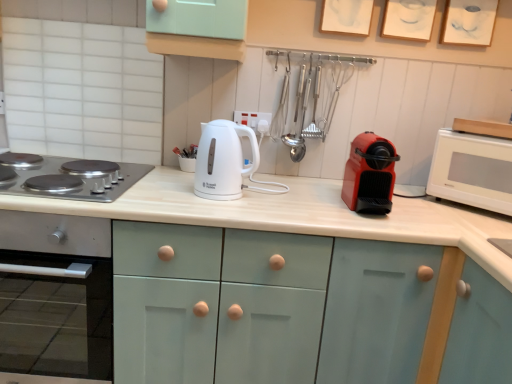
You are a GUI agent. You are given a task and a screenshot of the screen. Output one action in this format:
    pyautogui.click(x=<x>, y=<y>)
    Task: Click on the vacant space in between white glossy electric kettle at center, acting as the 1th kitchen appliance starting from the left, and red matte coffee machine at right, which is the 2th kitchen appliance from left to right
    
    Given the screenshot: What is the action you would take?
    pyautogui.click(x=296, y=204)